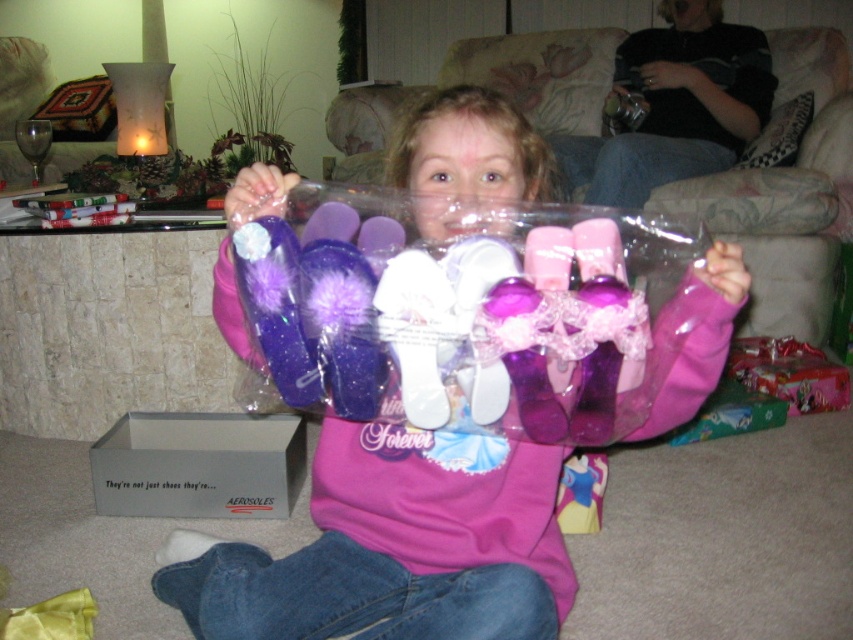
Question: Can you confirm if matte purple shoes at center is positioned to the right of gray cardboard box at lower left?

Choices:
 (A) no
 (B) yes

Answer: (B)

Question: Is matte purple shoes at center to the right of gray cardboard box at lower left from the viewer's perspective?

Choices:
 (A) no
 (B) yes

Answer: (B)

Question: Which of the following is the farthest from the observer?

Choices:
 (A) (308, 621)
 (B) (164, 449)

Answer: (B)

Question: Can you confirm if matte purple shoes at center is positioned to the right of gray cardboard box at lower left?

Choices:
 (A) no
 (B) yes

Answer: (B)